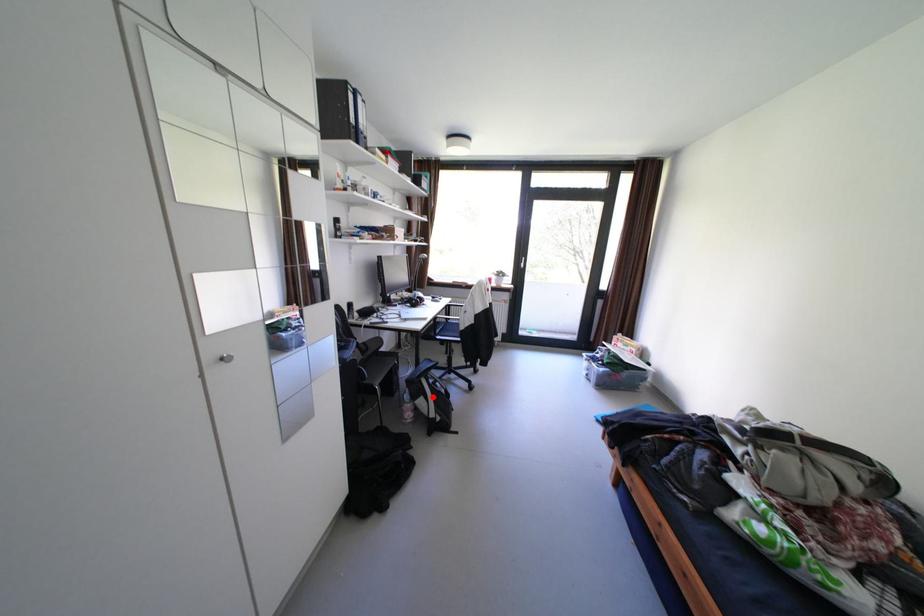
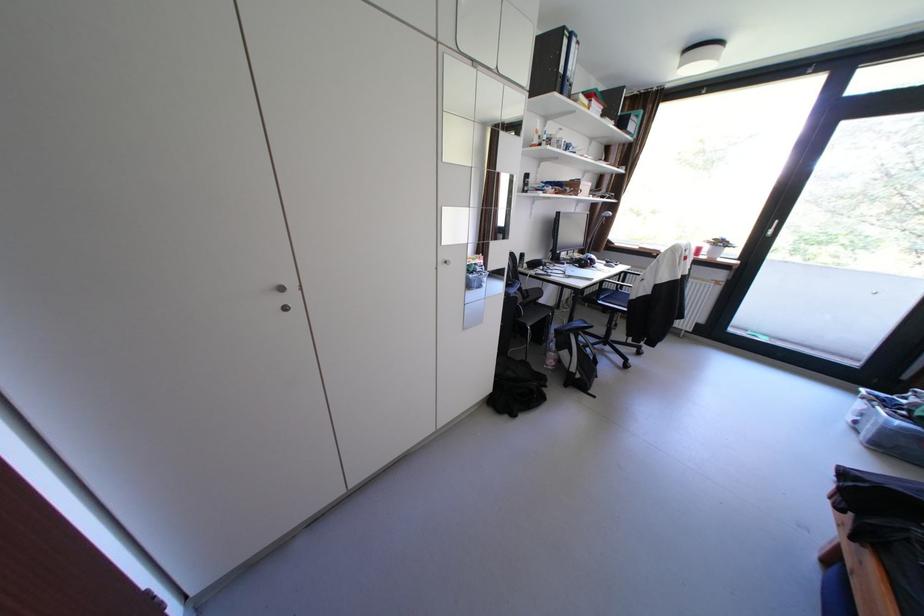
In the second image, find the point that corresponds to the highlighted location in the first image.

(578, 351)